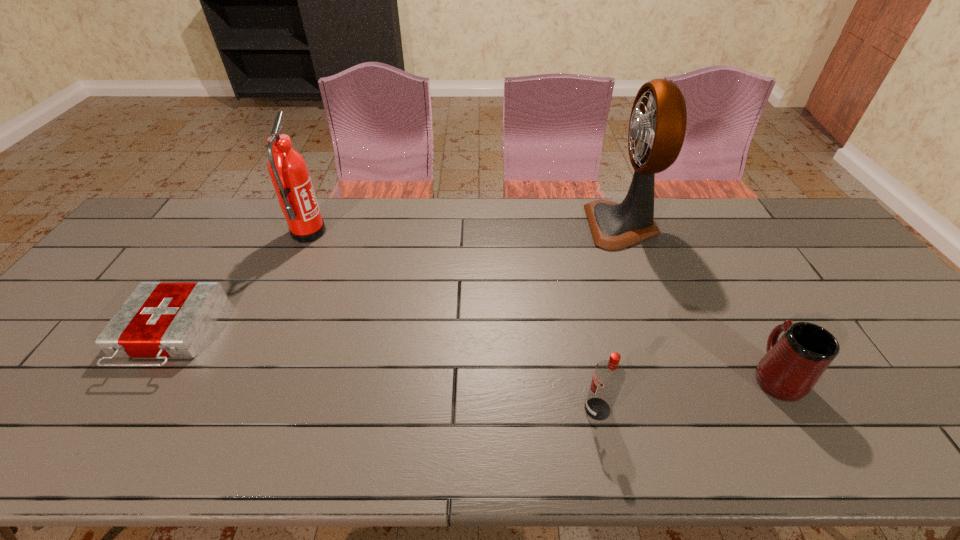
At what (x,y) coordinates should I click in order to perform the action: click on the tallest object. Please return your answer as a coordinate pair (x, y). The image size is (960, 540). Looking at the image, I should click on (657, 127).

Locate an element on the screen. The image size is (960, 540). the fourth object from left to right is located at coordinates (657, 127).

Locate an element on the screen. the second object from left to right is located at coordinates (288, 171).

This screenshot has width=960, height=540. In order to click on the fourth shortest object in this screenshot , I will do `click(288, 171)`.

This screenshot has height=540, width=960. I want to click on the third object from right to left, so click(x=608, y=377).

Locate an element on the screen. The width and height of the screenshot is (960, 540). the third shortest object is located at coordinates (608, 377).

I want to click on mug, so click(x=792, y=365).

This screenshot has height=540, width=960. I want to click on the fourth tallest object, so click(x=792, y=365).

This screenshot has height=540, width=960. I want to click on the shortest object, so click(161, 320).

The width and height of the screenshot is (960, 540). In order to click on the leftmost object in this screenshot , I will do `click(161, 320)`.